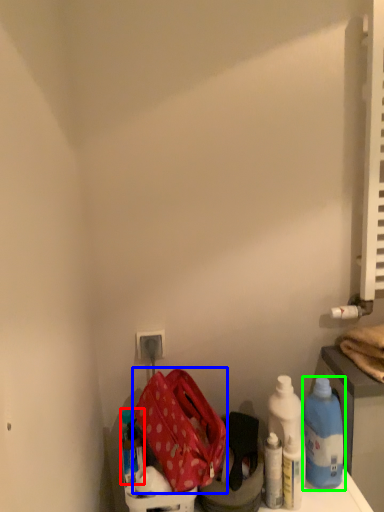
Question: Which object is positioned closest to bottle (highlighted by a red box)? Select from kit (highlighted by a blue box) and bottle (highlighted by a green box).

Choices:
 (A) kit
 (B) bottle

Answer: (A)